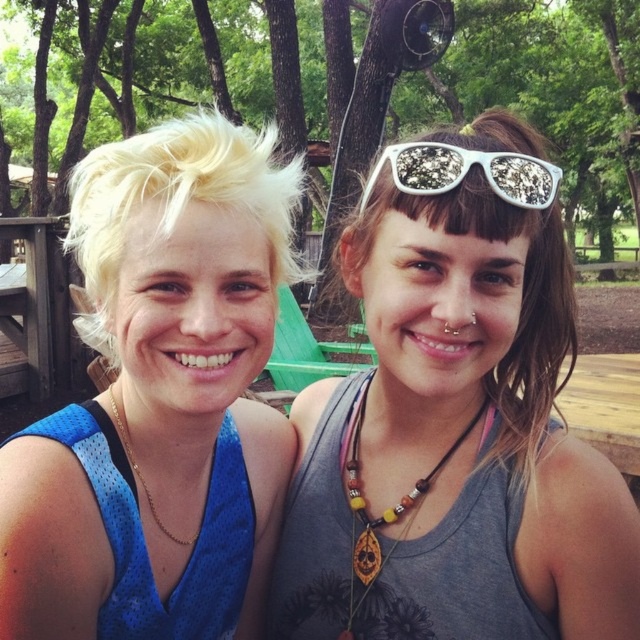
You are planning to place a 1.2 meter long picnic basket on the wooden picnic table at left. Considering the wooden bead necklace at center is placed on the table, can the picnic basket fit on the table without overlapping the necklace?

The wooden picnic table at left has a larger width than the wooden bead necklace at center, so the picnic basket can fit on the table without overlapping the necklace as long as there is enough space along the length of the table.

You are a photographer trying to capture a closeup of the white glittery sunglasses at upper center. The photographer is standing at the origin point. Which direction should you move to get a better shot?

The white glittery sunglasses at upper center is located at point (x=465, y=172), so you should move towards the upper left direction to get a better shot.